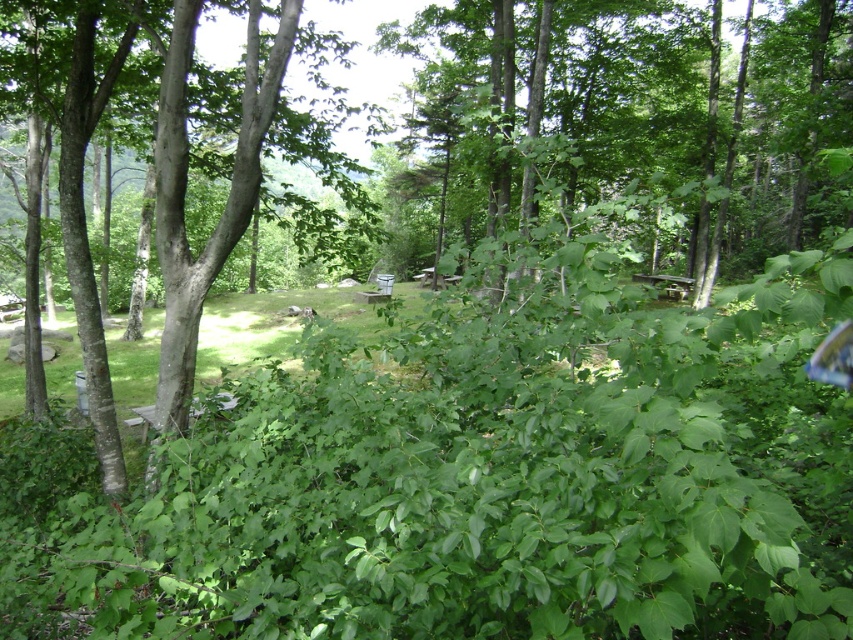
Question: Is green leafy tree at center bigger than smooth bark tree at center?

Choices:
 (A) yes
 (B) no

Answer: (A)

Question: Which of the following is the farthest from the observer?

Choices:
 (A) smooth bark tree at center
 (B) green leafy tree at center

Answer: (A)

Question: Which point is closer to the camera taking this photo?

Choices:
 (A) (177, 321)
 (B) (654, 163)

Answer: (A)

Question: Observing the image, what is the correct spatial positioning of green leafy tree at center in reference to smooth bark tree at center?

Choices:
 (A) above
 (B) below

Answer: (A)

Question: Which of the following is the closest to the observer?

Choices:
 (A) green leafy tree at center
 (B) smooth bark tree at center

Answer: (A)

Question: Does green leafy tree at center come behind smooth bark tree at center?

Choices:
 (A) yes
 (B) no

Answer: (B)